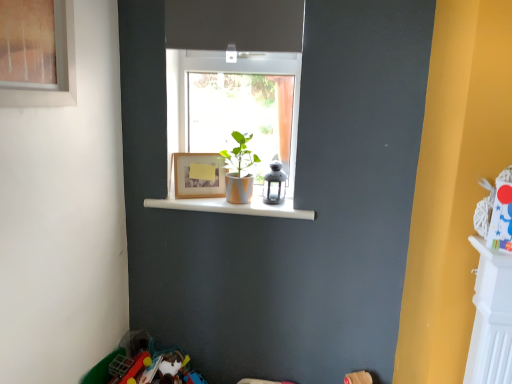
At what (x,y) coordinates should I click in order to perform the action: click on matte orange pot at center. Please return your answer as a coordinate pair (x, y). Looking at the image, I should click on (239, 170).

What do you see at coordinates (239, 170) in the screenshot?
I see `matte orange pot at center` at bounding box center [239, 170].

This screenshot has height=384, width=512. I want to click on matte orange pot at center, so click(239, 170).

How far apart are white glossy shelf at center and matte black lantern at upper center?

white glossy shelf at center and matte black lantern at upper center are 5.79 inches apart.

From a real-world perspective, which object stands above the other?

matte black lantern at upper center, from a real-world perspective.

What are the coordinates of `toy located behind the white glossy shelf at center` in the screenshot? It's located at 274,184.

Is white glossy shelf at center to the left or to the right of matte black lantern at upper center in the image?

white glossy shelf at center is to the left of matte black lantern at upper center.

Locate an element on the screen. The image size is (512, 384). houseplant above the matte black lantern at upper center (from the image's perspective) is located at coordinates (239, 170).

Which object is closer to the camera, matte orange pot at center or matte black lantern at upper center?

matte orange pot at center is closer to the camera.

Which of these two, matte orange pot at center or matte black lantern at upper center, stands taller?

matte orange pot at center.

Which point is more forward, (208, 159) or (222, 212)?

The point (222, 212) is in front.

Consider the image. How many degrees apart are the facing directions of wooden frame at center and white glossy shelf at center?

The angular difference between wooden frame at center and white glossy shelf at center is 31.5 degrees.

From the picture: Does wooden frame at center come in front of white glossy shelf at center?

No, the depth of wooden frame at center is greater than that of white glossy shelf at center.

Measure the distance between wooden frame at center and white glossy shelf at center.

They are 7.18 inches apart.

Considering the relative sizes of matte orange pot at center and white glossy shelf at center in the image provided, is matte orange pot at center wider than white glossy shelf at center?

Incorrect, the width of matte orange pot at center does not surpass that of white glossy shelf at center.

Is matte orange pot at center oriented towards white glossy shelf at center?

No, matte orange pot at center is not turned towards white glossy shelf at center.

How many degrees apart are the facing directions of matte orange pot at center and white glossy shelf at center?

They differ by 8.45e-06 degrees in their facing directions.

Is matte orange pot at center facing away from matte wooden frame at upper left?

matte orange pot at center is not turned away from matte wooden frame at upper left.

Locate an element on the screen. Image resolution: width=512 pixels, height=384 pixels. houseplant behind the matte wooden frame at upper left is located at coordinates (239, 170).

Would you consider matte orange pot at center to be distant from matte wooden frame at upper left?

No, matte orange pot at center is in close proximity to matte wooden frame at upper left.

From a real-world perspective, which object rests below the other?

In real-world perspective, matte black lantern at upper center is lower.

Can you confirm if matte wooden frame at upper left is positioned to the left of matte black lantern at upper center?

Indeed, matte wooden frame at upper left is positioned on the left side of matte black lantern at upper center.

Is matte black lantern at upper center at the back of matte wooden frame at upper left?

matte wooden frame at upper left does not have its back to matte black lantern at upper center.

From the image's perspective, which one is positioned higher, matte wooden frame at upper left or matte black lantern at upper center?

From the image's view, matte wooden frame at upper left is above.

From a real-world perspective, which is physically below, white glossy shelf at center or matte orange pot at center?

white glossy shelf at center, from a real-world perspective.

Is white glossy shelf at center wider than matte orange pot at center?

Yes.

Would you consider white glossy shelf at center to be distant from matte orange pot at center?

No, white glossy shelf at center is not far from matte orange pot at center.

Measure the distance between white glossy shelf at center and matte orange pot at center.

A distance of 6.01 inches exists between white glossy shelf at center and matte orange pot at center.

Where is `toy that appears behind the white glossy shelf at center`? This screenshot has width=512, height=384. toy that appears behind the white glossy shelf at center is located at coordinates (274, 184).

Where is `toy that is below the matte orange pot at center (from the image's perspective)`? toy that is below the matte orange pot at center (from the image's perspective) is located at coordinates (274, 184).

Based on their spatial positions, is wooden frame at center or matte black lantern at upper center further from matte wooden frame at upper left?

matte black lantern at upper center lies further to matte wooden frame at upper left than the other object.

Based on their spatial positions, is matte wooden frame at upper left or matte black lantern at upper center further from matte orange pot at center?

matte wooden frame at upper left is positioned further to the anchor matte orange pot at center.

Looking at the image, which one is located closer to matte orange pot at center, matte black lantern at upper center or white glossy shelf at center?

matte black lantern at upper center is closer to matte orange pot at center.

From the picture: Based on their spatial positions, is matte wooden frame at upper left or wooden frame at center closer to white glossy shelf at center?

wooden frame at center.

Looking at the image, which one is located further to matte black lantern at upper center, wooden frame at center or white glossy shelf at center?

Among the two, wooden frame at center is located further to matte black lantern at upper center.

Looking at the image, which one is located further to matte black lantern at upper center, matte wooden frame at upper left or white glossy shelf at center?

matte wooden frame at upper left is positioned further to the anchor matte black lantern at upper center.

When comparing their distances from matte black lantern at upper center, does white glossy shelf at center or matte wooden frame at upper left seem closer?

white glossy shelf at center.

Which object lies further to the anchor point matte orange pot at center, white glossy shelf at center or wooden frame at center?

The object further to matte orange pot at center is white glossy shelf at center.

This screenshot has width=512, height=384. Find the location of `window sill between wooden frame at center and matte black lantern at upper center in the horizontal direction`. window sill between wooden frame at center and matte black lantern at upper center in the horizontal direction is located at coordinates (233, 207).

Image resolution: width=512 pixels, height=384 pixels. Identify the location of houseplant located between matte wooden frame at upper left and white glossy shelf at center in the depth direction. (239, 170).

You are a GUI agent. You are given a task and a screenshot of the screen. Output one action in this format:
    pyautogui.click(x=<x>, y=<y>)
    Task: Click on the window sill between matte wooden frame at upper left and wooden frame at center from front to back
    The width and height of the screenshot is (512, 384).
    Given the screenshot: What is the action you would take?
    point(233,207)

What are the coordinates of `houseplant between wooden frame at center and matte black lantern at upper center` in the screenshot? It's located at (239, 170).